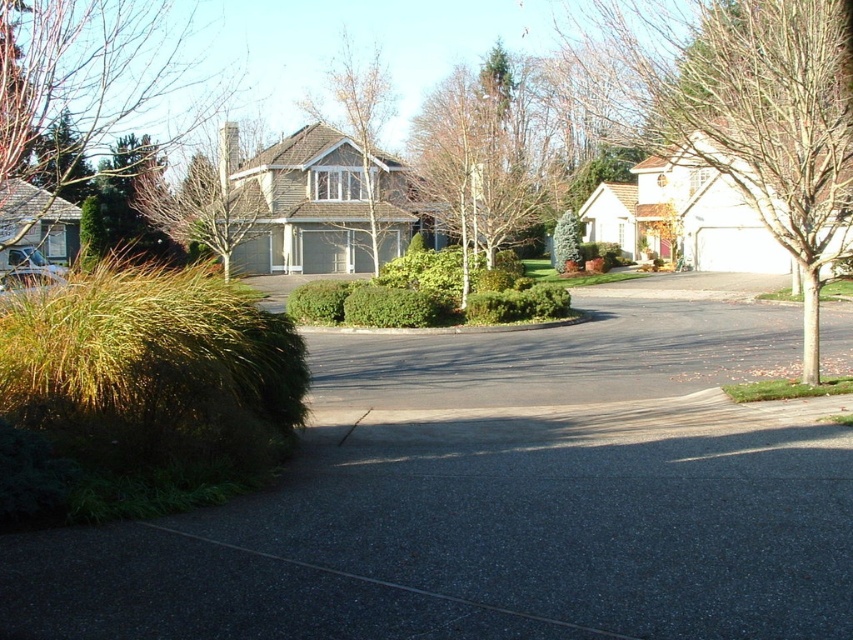
Question: Does black asphalt driveway at center appear over brown textured tree at center?

Choices:
 (A) yes
 (B) no

Answer: (B)

Question: Which point is farther to the camera?

Choices:
 (A) (607, 12)
 (B) (341, 561)
 (C) (296, 301)
 (D) (373, 72)

Answer: (D)

Question: Can you confirm if brown textured tree at center is smaller than green leafy bush at center?

Choices:
 (A) no
 (B) yes

Answer: (A)

Question: Is brown textured tree at center closer to the viewer compared to green leafy bush at center?

Choices:
 (A) no
 (B) yes

Answer: (A)

Question: Which point is closer to the camera?

Choices:
 (A) (686, 493)
 (B) (54, 102)
 (C) (434, 106)
 (D) (337, 307)

Answer: (A)

Question: Which object is the farthest from the black asphalt driveway at center?

Choices:
 (A) bare white tree at center
 (B) green leafy bush at center

Answer: (A)